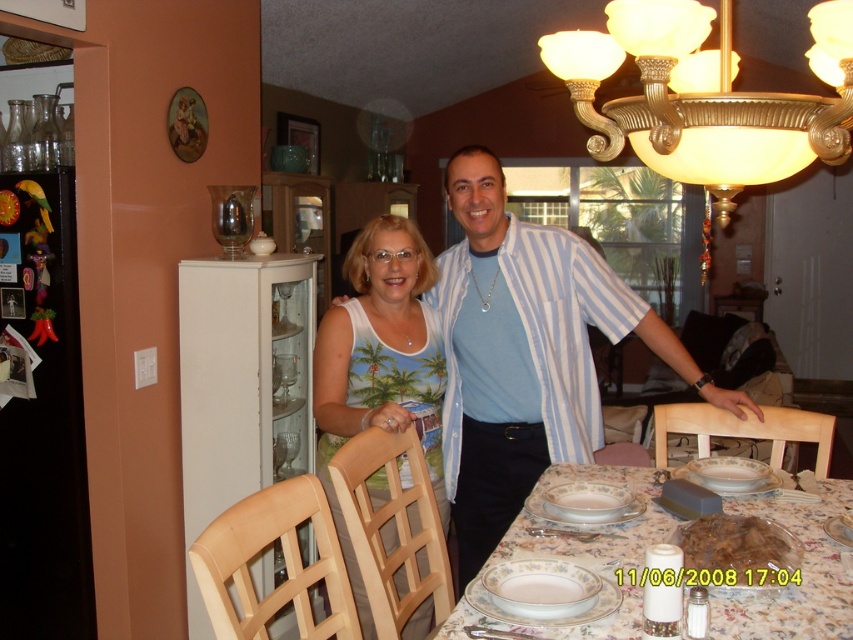
You are a guest at this dinner and are standing at the entrance of the dining area. You notice the matte blue shirt at center and the gold metallic chandelier at upper center. Which object is closer to you as you face the scene?

The matte blue shirt at center is closer to you because the gold metallic chandelier at upper center is behind it.

You are a guest at this dining table and want to pass a dish from the matte blue shirt at center to the gold metallic chandelier at upper center. In which direction should you move the dish?

To pass the dish from the matte blue shirt at center to the gold metallic chandelier at upper center, you should move it to the left since the matte blue shirt at center is to the right of the chandelier.

You are standing in the dining area and want to take a photo of the point at coordinates [473,244]. The camera you are using has a minimum focus distance of 8 feet. Will the camera be able to focus on the point?

The point at coordinates [473,244] is 7.50 feet from the camera, which is within the minimum focus distance of 8 feet. Therefore, the camera can focus on the point.